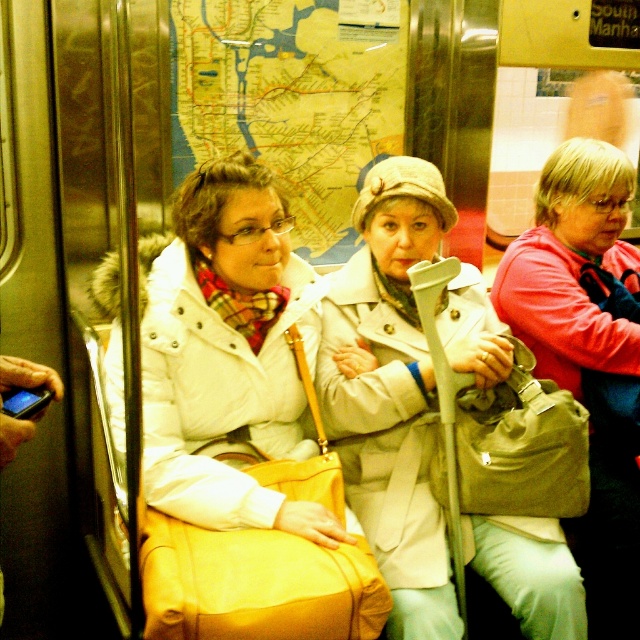
Question: Among these points, which one is nearest to the camera?

Choices:
 (A) (624, 582)
 (B) (266, 198)
 (C) (432, 502)

Answer: (B)

Question: Which of the following is the farthest from the observer?

Choices:
 (A) pink fabric jacket at center
 (B) white matte coat at center

Answer: (A)

Question: Where is white matte coat at center located in relation to beige fabric coat at center in the image?

Choices:
 (A) right
 (B) left

Answer: (B)

Question: Can you confirm if white matte coat at center is positioned above beige fabric coat at center?

Choices:
 (A) yes
 (B) no

Answer: (B)

Question: Based on their relative distances, which object is farther from the pink fabric jacket at center?

Choices:
 (A) beige fabric coat at center
 (B) white matte coat at center

Answer: (B)

Question: Can you confirm if white matte coat at center is wider than beige fabric coat at center?

Choices:
 (A) no
 (B) yes

Answer: (B)